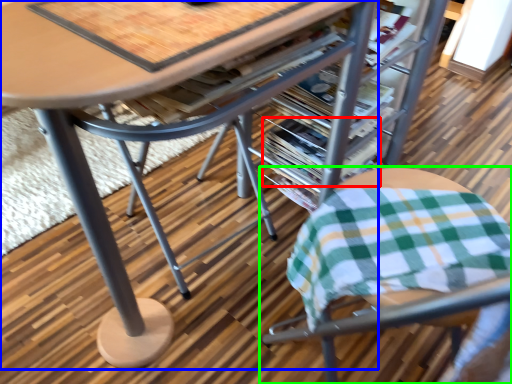
Question: Considering the real-world distances, which object is farthest from magazine (highlighted by a red box)? table (highlighted by a blue box) or chair (highlighted by a green box)?

Choices:
 (A) table
 (B) chair

Answer: (A)